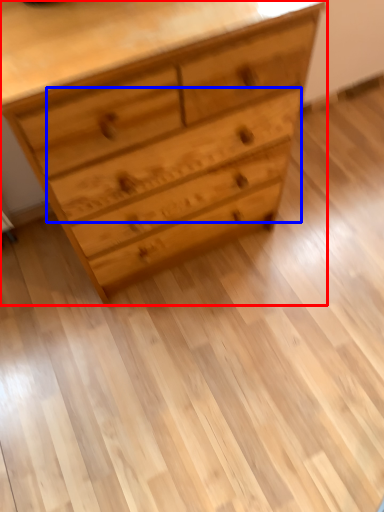
Question: Among these objects, which one is farthest to the camera, chest of drawers (highlighted by a red box) or drawer (highlighted by a blue box)?

Choices:
 (A) chest of drawers
 (B) drawer

Answer: (B)